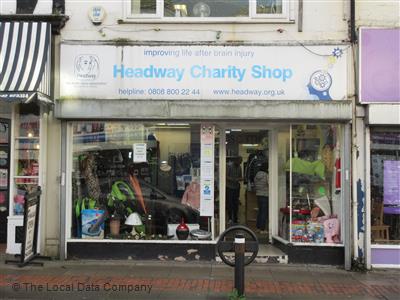
What are the coordinates of `window` in the screenshot? It's located at (170, 178), (319, 167), (385, 154), (24, 149).